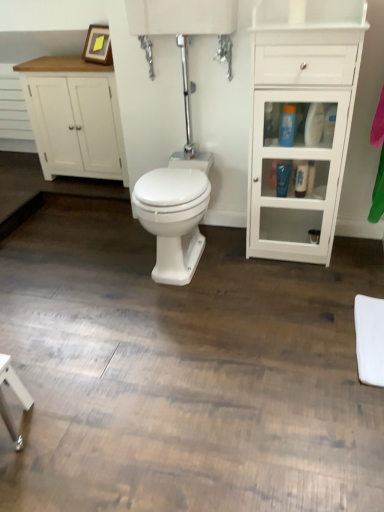
Find the location of a particular element. The width and height of the screenshot is (384, 512). vacant space that is to the left of white glossy cabinet at right, which is counted as the 2th bathroom cabinet, starting from the back is located at coordinates (230, 259).